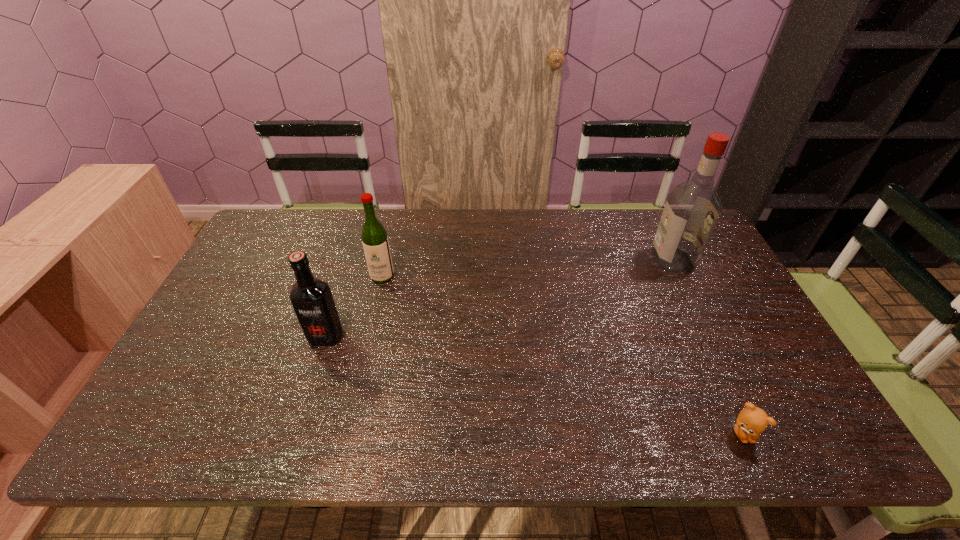
You are a GUI agent. You are given a task and a screenshot of the screen. Output one action in this format:
    pyautogui.click(x=<x>, y=<y>)
    Task: Click on the blank space that satisfies the following two spatial constraints: 1. on the front-facing side of the tallest liquor; 2. on the face of the nearest object
    
    Given the screenshot: What is the action you would take?
    pyautogui.click(x=757, y=434)

Locate an element on the screen. free space that satisfies the following two spatial constraints: 1. on the front-facing side of the rightmost liquor; 2. on the face of the teddy bear is located at coordinates (757, 434).

Locate an element on the screen. Image resolution: width=960 pixels, height=540 pixels. blank area in the image that satisfies the following two spatial constraints: 1. on the front-facing side of the tallest object; 2. on the face of the teddy bear is located at coordinates (757, 434).

Where is `vacant space that satisfies the following two spatial constraints: 1. on the front-facing side of the rightmost liquor; 2. on the label of the second liquor from left to right`? Image resolution: width=960 pixels, height=540 pixels. vacant space that satisfies the following two spatial constraints: 1. on the front-facing side of the rightmost liquor; 2. on the label of the second liquor from left to right is located at coordinates (681, 276).

Locate an element on the screen. This screenshot has width=960, height=540. free point that satisfies the following two spatial constraints: 1. on the front-facing side of the rightmost liquor; 2. on the front-facing side of the nearest liquor is located at coordinates (710, 336).

I want to click on vacant point that satisfies the following two spatial constraints: 1. on the front-facing side of the tallest object; 2. on the face of the shortest object, so click(x=757, y=434).